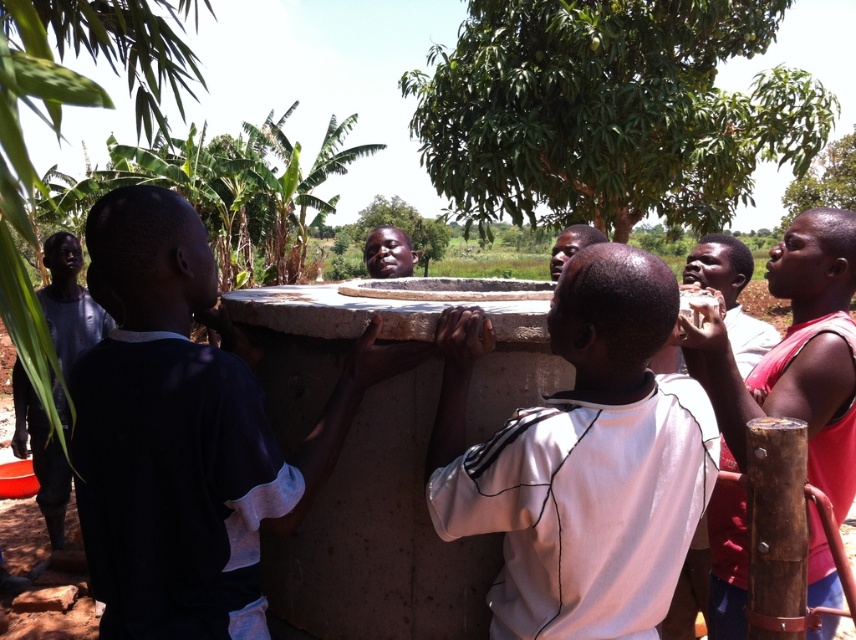
You are a photographer trying to capture a group photo of the children and the wooden hand pump at right. Since you want to ensure that the dark blue shirt at left is clearly visible, which object should you focus on first considering their sizes?

The dark blue shirt at left should be focused on first because its width is larger than the wooden hand pump at right, making it easier to capture clearly.

You are a photographer trying to capture a group shot of the children. You notice the white matte shirt at center and the smooth skin face at center in your frame. Based on their positions, which child should you ask to move slightly to the right to align them better?

The white matte shirt at center should move slightly to the right to align with the smooth skin face at center since it is currently positioned to the left of it.